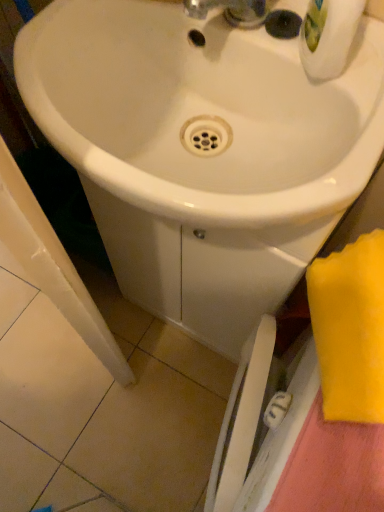
Question: Considering the relative positions of white glossy sink at center and yellow fabric towel at lower right in the image provided, is white glossy sink at center to the left or to the right of yellow fabric towel at lower right?

Choices:
 (A) left
 (B) right

Answer: (A)

Question: From their relative heights in the image, would you say white glossy sink at center is taller or shorter than yellow fabric towel at lower right?

Choices:
 (A) tall
 (B) short

Answer: (A)

Question: From a real-world perspective, is white glossy sink at center above or below yellow fabric towel at lower right?

Choices:
 (A) above
 (B) below

Answer: (B)

Question: Is yellow fabric towel at lower right spatially inside white glossy sink at center, or outside of it?

Choices:
 (A) inside
 (B) outside

Answer: (B)

Question: In the image, is yellow fabric towel at lower right positioned in front of or behind white glossy sink at center?

Choices:
 (A) behind
 (B) front

Answer: (B)

Question: From a real-world perspective, is yellow fabric towel at lower right physically located above or below white glossy sink at center?

Choices:
 (A) above
 (B) below

Answer: (A)

Question: Looking at their shapes, would you say yellow fabric towel at lower right is wider or thinner than white glossy sink at center?

Choices:
 (A) wide
 (B) thin

Answer: (B)